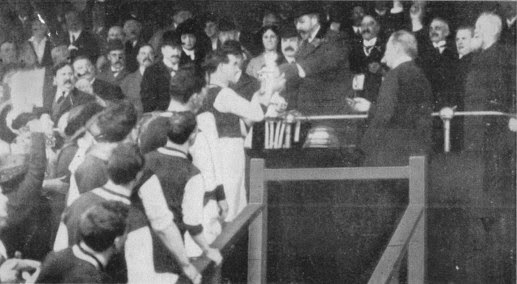
Find the location of a particular element. metal looking hand rail is located at coordinates (480, 115), (326, 114).